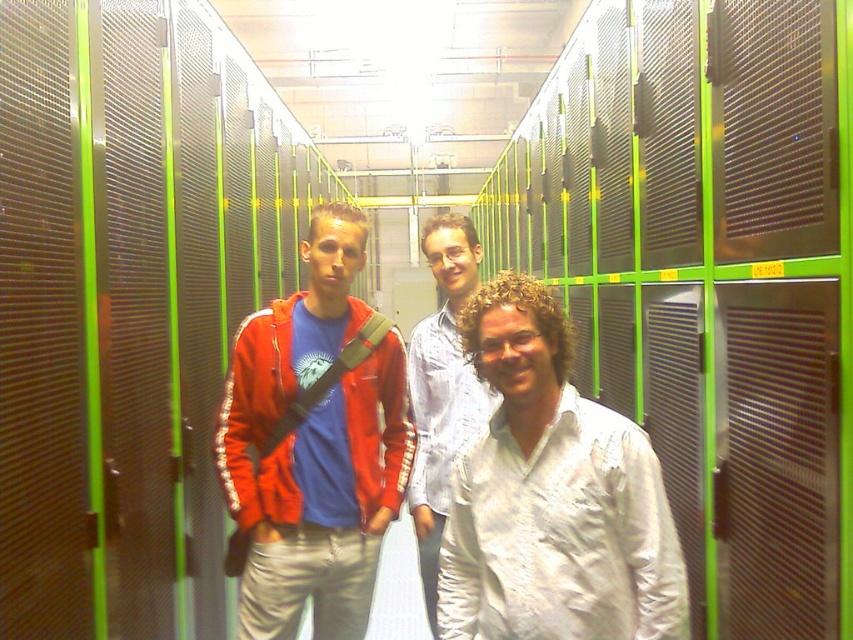
Who is higher up, white satin shirt at center or white textured shirt at center?

Positioned higher is white satin shirt at center.

Which of these two, white satin shirt at center or white textured shirt at center, stands taller?

white textured shirt at center is taller.

The height and width of the screenshot is (640, 853). In order to click on white satin shirt at center in this screenshot , I will do `click(552, 497)`.

Is matte red jacket at center wider than white textured shirt at center?

Indeed, matte red jacket at center has a greater width compared to white textured shirt at center.

Can you confirm if matte red jacket at center is taller than white textured shirt at center?

No.

This screenshot has height=640, width=853. What are the coordinates of `matte red jacket at center` in the screenshot? It's located at (312, 444).

Does white satin shirt at center have a greater width compared to matte red jacket at center?

In fact, white satin shirt at center might be narrower than matte red jacket at center.

Between white satin shirt at center and matte red jacket at center, which one is positioned higher?

white satin shirt at center

Is point (599, 422) closer to viewer compared to point (225, 476)?

Yes, it is in front of point (225, 476).

The image size is (853, 640). I want to click on white satin shirt at center, so click(x=552, y=497).